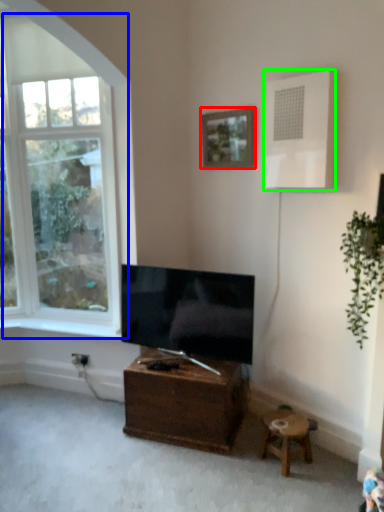
Question: Which object is positioned farthest from picture frame (highlighted by a red box)? Select from window (highlighted by a blue box) and air conditioner (highlighted by a green box).

Choices:
 (A) window
 (B) air conditioner

Answer: (A)